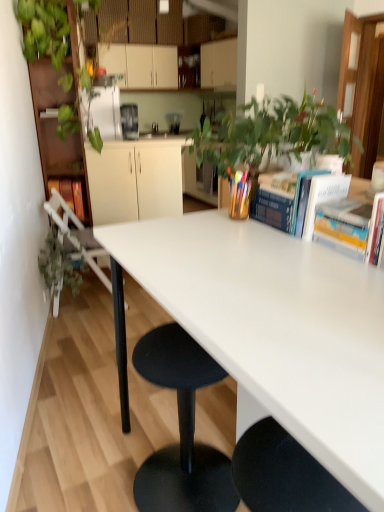
Question: Is matte white cabinets at upper center, placed as the second cabinetry when sorted from bottom to top, positioned behind metallic stainless steel coffee machine at center, arranged as the 1th appliance when viewed from the left?

Choices:
 (A) yes
 (B) no

Answer: (A)

Question: From a real-world perspective, is matte white cabinets at upper center, the first cabinetry when ordered from top to bottom, located beneath metallic stainless steel coffee machine at center, acting as the 2th appliance starting from the back?

Choices:
 (A) yes
 (B) no

Answer: (B)

Question: Is matte white cabinets at upper center, placed as the second cabinetry when sorted from bottom to top, closer to camera compared to metallic stainless steel coffee machine at center, arranged as the 1th appliance when viewed from the left?

Choices:
 (A) no
 (B) yes

Answer: (A)

Question: Considering the relative sizes of matte white cabinets at upper center, the first cabinetry when ordered from top to bottom, and metallic stainless steel coffee machine at center, which appears as the 2th appliance when viewed from the right, in the image provided, is matte white cabinets at upper center, the first cabinetry when ordered from top to bottom, wider than metallic stainless steel coffee machine at center, which appears as the 2th appliance when viewed from the right,?

Choices:
 (A) no
 (B) yes

Answer: (B)

Question: Are matte white cabinets at upper center, the 1th cabinetry when ordered from back to front, and metallic stainless steel coffee machine at center, which appears as the 2th appliance when viewed from the right, located far from each other?

Choices:
 (A) no
 (B) yes

Answer: (A)

Question: Is matte white cabinets at upper center, the 2th cabinetry from the front, taller than metallic stainless steel coffee machine at center, which appears as the 2th appliance when viewed from the right?

Choices:
 (A) no
 (B) yes

Answer: (B)

Question: Considering the relative sizes of blue hardcover book at upper right, positioned as the 3th book in back-to-front order, and hardcover book at upper right, acting as the 2th book starting from the back, in the image provided, is blue hardcover book at upper right, positioned as the 3th book in back-to-front order, bigger than hardcover book at upper right, acting as the 2th book starting from the back,?

Choices:
 (A) no
 (B) yes

Answer: (B)

Question: Is blue hardcover book at upper right, the 3th book from the right, positioned behind hardcover book at upper right, which appears as the 4th book when viewed from the right?

Choices:
 (A) no
 (B) yes

Answer: (A)

Question: Considering the relative sizes of blue hardcover book at upper right, positioned as the 3th book in back-to-front order, and hardcover book at upper right, which is the second book in left-to-right order, in the image provided, is blue hardcover book at upper right, positioned as the 3th book in back-to-front order, wider than hardcover book at upper right, which is the second book in left-to-right order,?

Choices:
 (A) no
 (B) yes

Answer: (B)

Question: Can hardcover book at upper right, which is the second book in left-to-right order, be found inside blue hardcover book at upper right, the 3th book from the right?

Choices:
 (A) no
 (B) yes

Answer: (A)

Question: Is blue hardcover book at upper right, the third book positioned from the left, positioned far away from hardcover book at upper right, which is the second book in left-to-right order?

Choices:
 (A) no
 (B) yes

Answer: (A)

Question: Is blue hardcover book at upper right, positioned as the 3th book in back-to-front order, facing towards hardcover book at upper right, which is the second book in left-to-right order?

Choices:
 (A) yes
 (B) no

Answer: (B)

Question: Can you confirm if hardcover book at left, which is counted as the 5th book, starting from the front, is positioned to the left of black plastic stool at center?

Choices:
 (A) yes
 (B) no

Answer: (A)